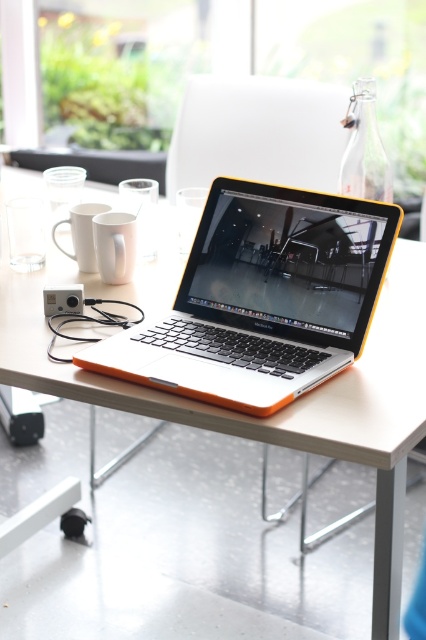
The image size is (426, 640). What do you see at coordinates (245, 416) in the screenshot?
I see `white matte table at center` at bounding box center [245, 416].

Does white matte table at center have a greater height compared to orange plastic laptop at center?

Yes.

The width and height of the screenshot is (426, 640). I want to click on white matte table at center, so click(x=245, y=416).

Find the location of `white matte table at center`. white matte table at center is located at coordinates (245, 416).

Between white matte table at center and white matte mug at upper left, which one appears on the left side from the viewer's perspective?

white matte mug at upper left is more to the left.

Can you confirm if white matte table at center is taller than white matte mug at upper left?

Indeed, white matte table at center has a greater height compared to white matte mug at upper left.

Locate an element on the screen. The height and width of the screenshot is (640, 426). white matte table at center is located at coordinates (245, 416).

You are a GUI agent. You are given a task and a screenshot of the screen. Output one action in this format:
    pyautogui.click(x=<x>, y=<y>)
    Task: Click on the white matte table at center
    Image resolution: width=426 pixels, height=640 pixels.
    Given the screenshot: What is the action you would take?
    click(245, 416)

Based on the photo, is orange plastic laptop at center smaller than white matte mug at upper left?

Incorrect, orange plastic laptop at center is not smaller in size than white matte mug at upper left.

From the picture: Can you confirm if orange plastic laptop at center is shorter than white matte mug at upper left?

No.

Describe the element at coordinates (261, 300) in the screenshot. I see `orange plastic laptop at center` at that location.

Locate an element on the screen. Image resolution: width=426 pixels, height=640 pixels. orange plastic laptop at center is located at coordinates (261, 300).